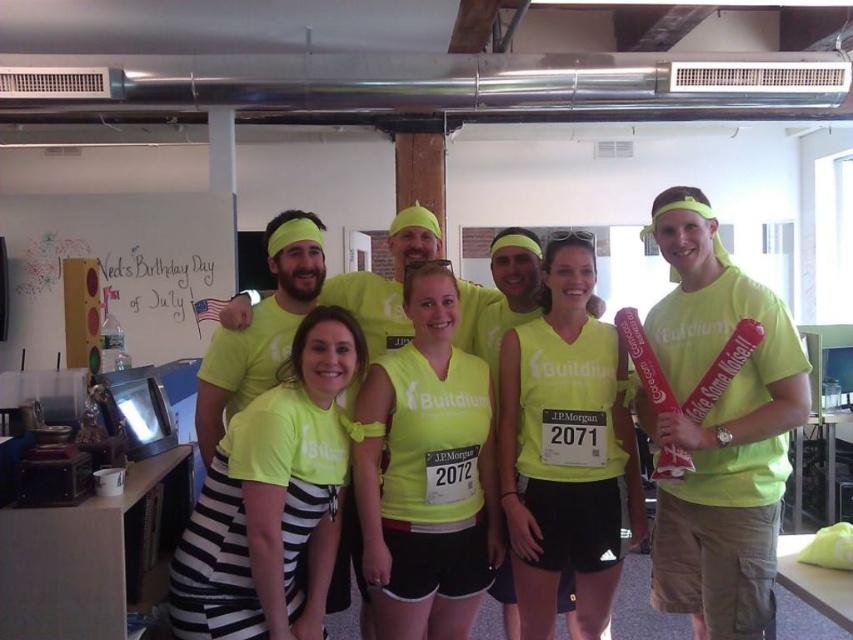
Which of these two, matte yellow shirt at center or whiteboard at upper left, stands shorter?

matte yellow shirt at center is shorter.

Which is behind, point (376, 563) or point (183, 292)?

The point (183, 292) is behind.

Where is `matte yellow shirt at center`? This screenshot has height=640, width=853. matte yellow shirt at center is located at coordinates (427, 474).

Does neon yellow shirt at center have a larger size compared to neon yellow jersey at center?

No.

Which of these two, neon yellow shirt at center or neon yellow jersey at center, stands shorter?

With less height is neon yellow shirt at center.

Who is more forward, (x=235, y=602) or (x=537, y=486)?

Point (x=235, y=602)

Locate an element on the screen. This screenshot has height=640, width=853. neon yellow shirt at center is located at coordinates (273, 499).

Who is taller, neon yellow jersey at center or neon yellow t-shirt at center?

neon yellow jersey at center is taller.

What do you see at coordinates (566, 449) in the screenshot? I see `neon yellow jersey at center` at bounding box center [566, 449].

Does point (637, 488) lie behind point (399, 227)?

No, it is in front of (399, 227).

The image size is (853, 640). What are the coordinates of `neon yellow jersey at center` in the screenshot? It's located at (566, 449).